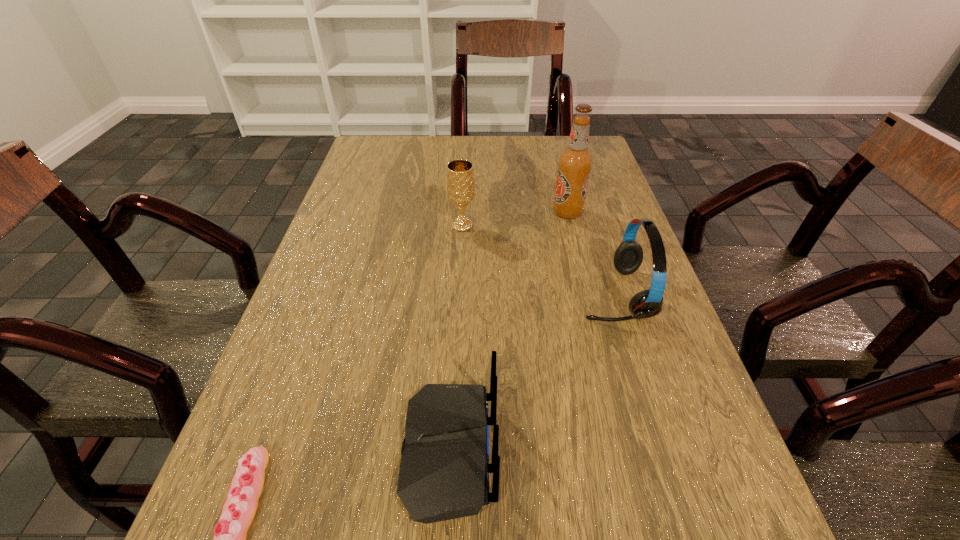
Find the location of a particular element. The height and width of the screenshot is (540, 960). beer bottle is located at coordinates (574, 165).

Where is `the third nearest object`? This screenshot has width=960, height=540. the third nearest object is located at coordinates (628, 257).

Where is `chalice`? The width and height of the screenshot is (960, 540). chalice is located at coordinates (460, 177).

This screenshot has height=540, width=960. Identify the location of the second shortest object. (444, 471).

Find the location of a particular element. This screenshot has width=960, height=540. free space located on the front label of the tallest object is located at coordinates (496, 213).

The image size is (960, 540). I want to click on vacant point located 0.200m on the front label of the tallest object, so click(x=473, y=213).

This screenshot has height=540, width=960. Identify the location of vacant area situated 0.170m on the front label of the tallest object. (485, 213).

At what (x,y) coordinates should I click in order to perform the action: click on free space located 0.330m with the microphone attached to the side of the third farthest object. Please return your answer as a coordinate pair (x, y). Looking at the image, I should click on (420, 294).

You are a GUI agent. You are given a task and a screenshot of the screen. Output one action in this format:
    pyautogui.click(x=<x>, y=<y>)
    Task: Click on the vacant region located with the microphone attached to the side of the third farthest object
    
    Given the screenshot: What is the action you would take?
    pyautogui.click(x=502, y=294)

I want to click on free space located with the microphone attached to the side of the third farthest object, so click(x=420, y=294).